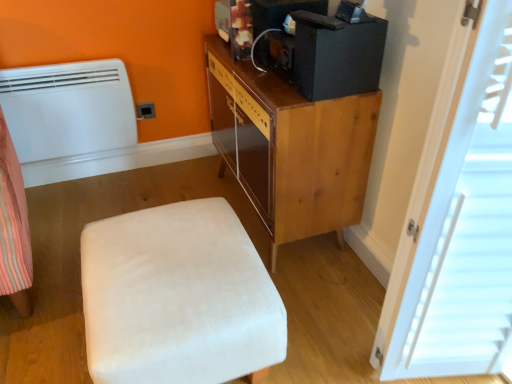
Question: Does black matte desktop computer at upper right have a greater height compared to black matte speaker at upper center?

Choices:
 (A) no
 (B) yes

Answer: (B)

Question: Considering the relative positions of black matte desktop computer at upper right and black matte speaker at upper center in the image provided, is black matte desktop computer at upper right to the right of black matte speaker at upper center from the viewer's perspective?

Choices:
 (A) yes
 (B) no

Answer: (A)

Question: Could you tell me if black matte desktop computer at upper right is turned towards black matte speaker at upper center?

Choices:
 (A) no
 (B) yes

Answer: (A)

Question: From a real-world perspective, is black matte desktop computer at upper right on top of black matte speaker at upper center?

Choices:
 (A) no
 (B) yes

Answer: (B)

Question: Considering the relative sizes of black matte desktop computer at upper right and black matte speaker at upper center in the image provided, is black matte desktop computer at upper right wider than black matte speaker at upper center?

Choices:
 (A) yes
 (B) no

Answer: (A)

Question: Does black matte desktop computer at upper right have a lesser height compared to black matte speaker at upper center?

Choices:
 (A) no
 (B) yes

Answer: (A)

Question: Can you confirm if wooden cabinet at upper right is thinner than black matte speaker at upper center?

Choices:
 (A) no
 (B) yes

Answer: (A)

Question: Considering the relative sizes of wooden cabinet at upper right and black matte speaker at upper center in the image provided, is wooden cabinet at upper right wider than black matte speaker at upper center?

Choices:
 (A) yes
 (B) no

Answer: (A)

Question: Would you say wooden cabinet at upper right is outside black matte speaker at upper center?

Choices:
 (A) no
 (B) yes

Answer: (B)

Question: From the image's perspective, is wooden cabinet at upper right beneath black matte speaker at upper center?

Choices:
 (A) yes
 (B) no

Answer: (A)

Question: Considering the relative sizes of wooden cabinet at upper right and black matte speaker at upper center in the image provided, is wooden cabinet at upper right taller than black matte speaker at upper center?

Choices:
 (A) no
 (B) yes

Answer: (B)

Question: From the image's perspective, is wooden cabinet at upper right located above black matte speaker at upper center?

Choices:
 (A) yes
 (B) no

Answer: (B)

Question: Is black matte desktop computer at upper right at the back of black matte speaker at upper center?

Choices:
 (A) yes
 (B) no

Answer: (B)